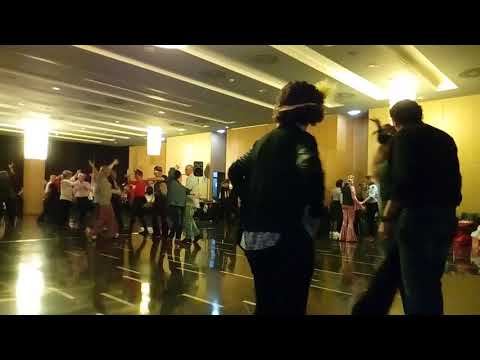
The height and width of the screenshot is (360, 480). In order to click on lights hanging from ceiling in this screenshot , I will do `click(34, 133)`, `click(158, 136)`, `click(398, 84)`.